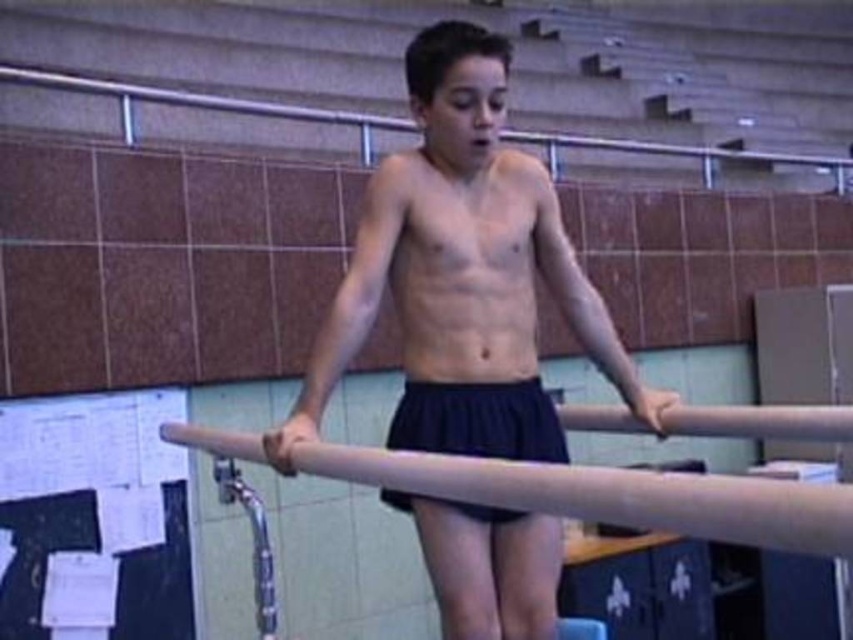
You are a photographer setting up for a sports event. You notice a white paper at left and a black fabric shorts at center in the frame. Which object should you adjust your camera focus to first if you want to capture both clearly? Please explain your reasoning based on their positions.

The white paper at left is located below the black fabric shorts at center. Since the white paper at left is positioned lower in the frame, you should adjust your camera focus to the black fabric shorts at center first, as it is closer to the main subject and central to the composition. Then, ensure the white paper at left is within the depth of field to maintain clarity for both objects.

You are a photographer setting up a shot in the gym. You need to ensure the smooth skin man at center and the white paper at left are both in frame. Given that the camera can only capture objects up to 1.5 meters wide, will both fit within the frame?

The smooth skin man at center has a larger width than the white paper at left. Since the camera can only capture up to 1.5 meters wide, if the man exceeds this width, he alone would not fit. However, the description only states his width is larger than the paper but does not specify exact measurements. Without knowing the exact width of either, it is impossible to determine if both will fit within the camera frame.

A gymnast is positioned between two parallel bars in a gym. The two points marked as point (757, 496) are located on the bars. If the gymnast needs to adjust their stance to ensure their hands can reach both points simultaneously, what is the minimum distance their hands must span?

The two points marked as point (757, 496) are 83.23 centimeters apart. Therefore, the gymnast must be able to span at least 83.23 centimeters with their hands to reach both points simultaneously.